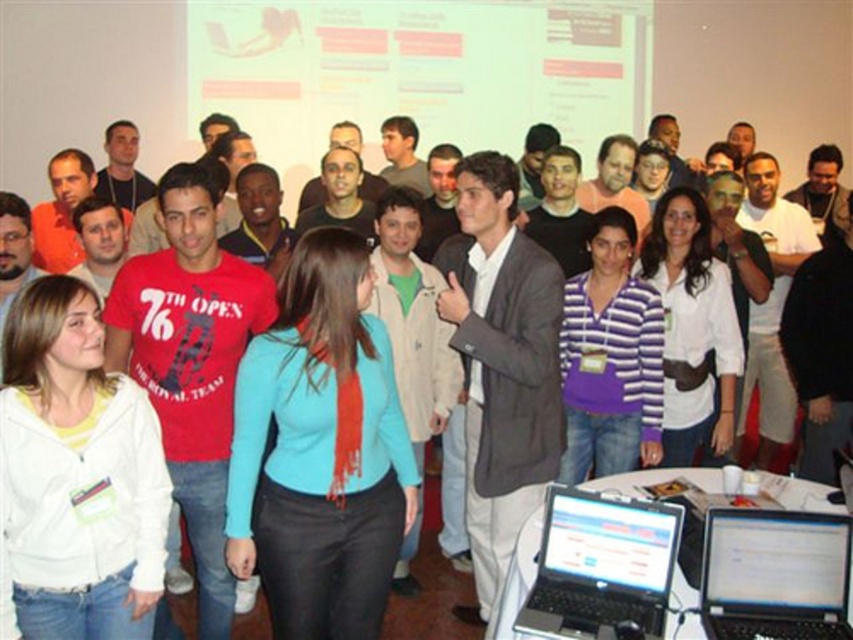
Does dark gray suit at center have a lesser width compared to silver metallic laptop at lower center?

No, dark gray suit at center is not thinner than silver metallic laptop at lower center.

Does dark gray suit at center lie in front of silver metallic laptop at lower center?

No.

The image size is (853, 640). I want to click on dark gray suit at center, so click(x=502, y=365).

Can you confirm if blue fabric sweater at center is wider than black plastic laptop at lower right?

Yes, blue fabric sweater at center is wider than black plastic laptop at lower right.

This screenshot has height=640, width=853. What are the coordinates of `blue fabric sweater at center` in the screenshot? It's located at (320, 451).

This screenshot has width=853, height=640. I want to click on blue fabric sweater at center, so click(320, 451).

Is point (672, 554) positioned after point (837, 515)?

That is True.

Is point (583, 540) positioned after point (791, 538)?

Yes, it is behind point (791, 538).

Identify the location of silver metallic laptop at lower center. The image size is (853, 640). tap(601, 566).